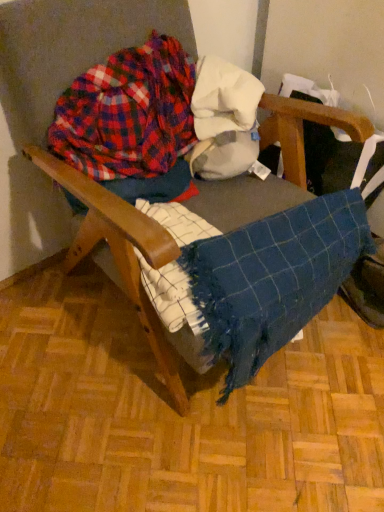
Question: Is blue woven blanket at center inside or outside of plaid fabric at upper left?

Choices:
 (A) inside
 (B) outside

Answer: (B)

Question: From a real-world perspective, is blue woven blanket at center positioned above or below plaid fabric at upper left?

Choices:
 (A) above
 (B) below

Answer: (B)

Question: Would you say blue woven blanket at center is to the left or to the right of plaid fabric at upper left in the picture?

Choices:
 (A) right
 (B) left

Answer: (A)

Question: Relative to blue woven blanket at center, is plaid fabric at upper left in front or behind?

Choices:
 (A) behind
 (B) front

Answer: (A)

Question: From the image's perspective, is plaid fabric at upper left located above or below blue woven blanket at center?

Choices:
 (A) above
 (B) below

Answer: (A)

Question: Does point (182, 58) appear closer or farther from the camera than point (253, 296)?

Choices:
 (A) farther
 (B) closer

Answer: (A)

Question: Considering the relative positions of plaid fabric at upper left and blue woven blanket at center in the image provided, is plaid fabric at upper left to the left or to the right of blue woven blanket at center?

Choices:
 (A) right
 (B) left

Answer: (B)